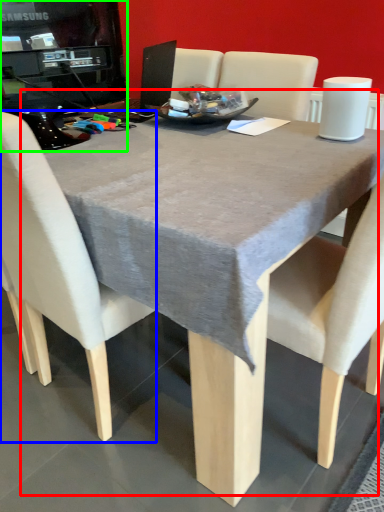
Question: Considering the real-world distances, which object is closest to table (highlighted by a red box)? chair (highlighted by a blue box) or desktop computer (highlighted by a green box).

Choices:
 (A) chair
 (B) desktop computer

Answer: (A)